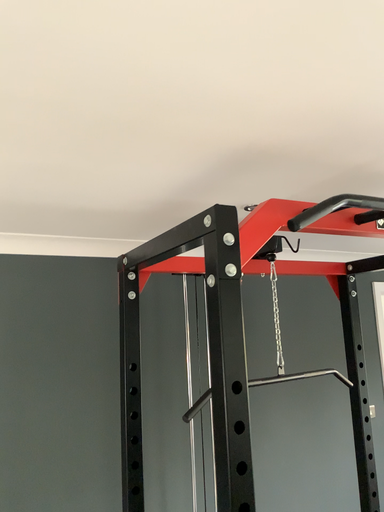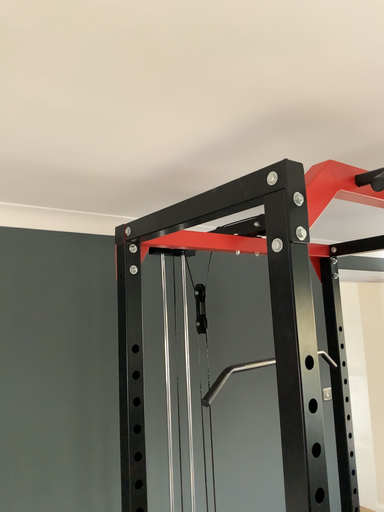
Question: Which way did the camera rotate in the video?

Choices:
 (A) rotated right
 (B) rotated left

Answer: (A)